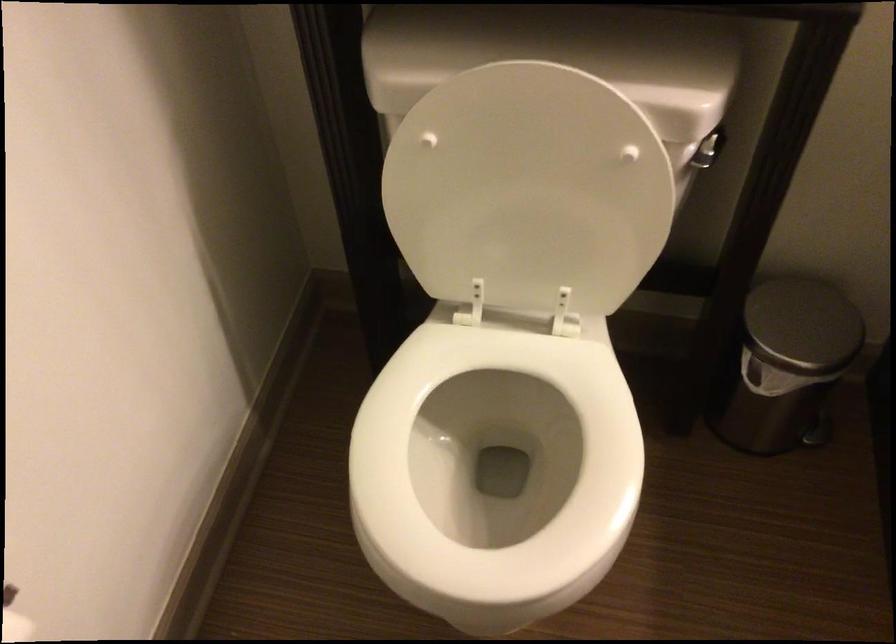
This screenshot has height=644, width=896. What do you see at coordinates (803, 325) in the screenshot?
I see `the trash can lid` at bounding box center [803, 325].